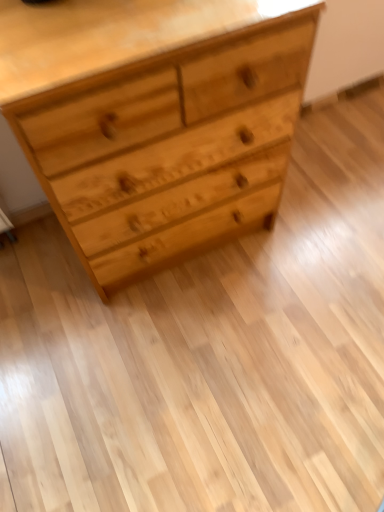
You are a GUI agent. You are given a task and a screenshot of the screen. Output one action in this format:
    pyautogui.click(x=<x>, y=<y>)
    Task: Click on the vacant area that lies between natural wood chest of drawers at upper center and natural wood drawer at center
    This screenshot has height=512, width=384.
    Given the screenshot: What is the action you would take?
    pyautogui.click(x=284, y=182)